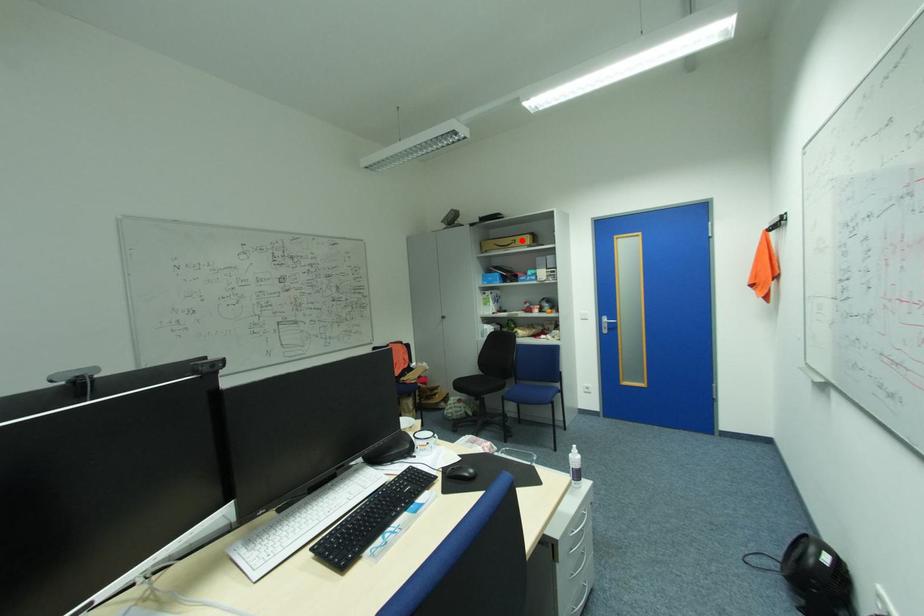
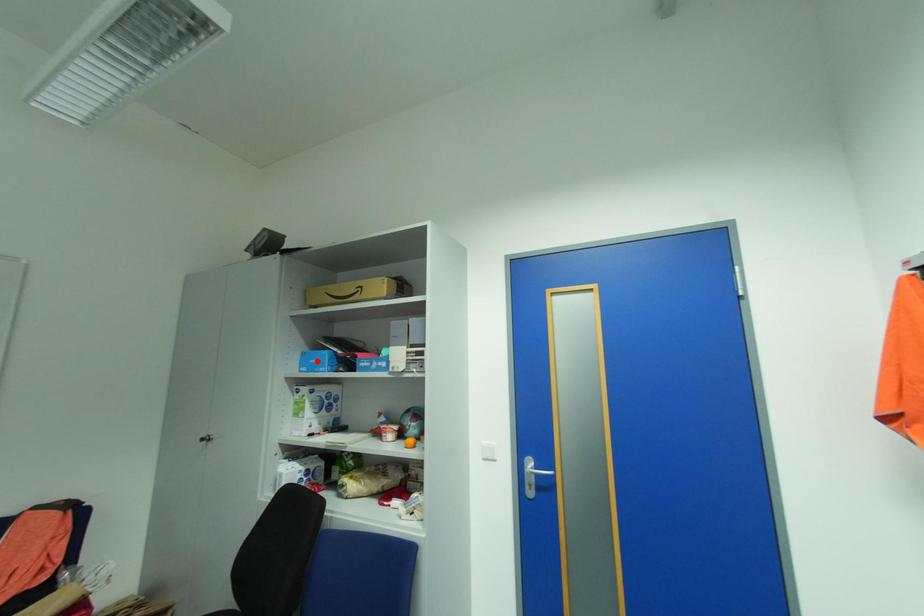
I am providing you with two images of the same scene from different viewpoints. A red point is marked on the first image and another point is marked on the second image. Is the red point in image1 aligned with the point shown in image2?

No